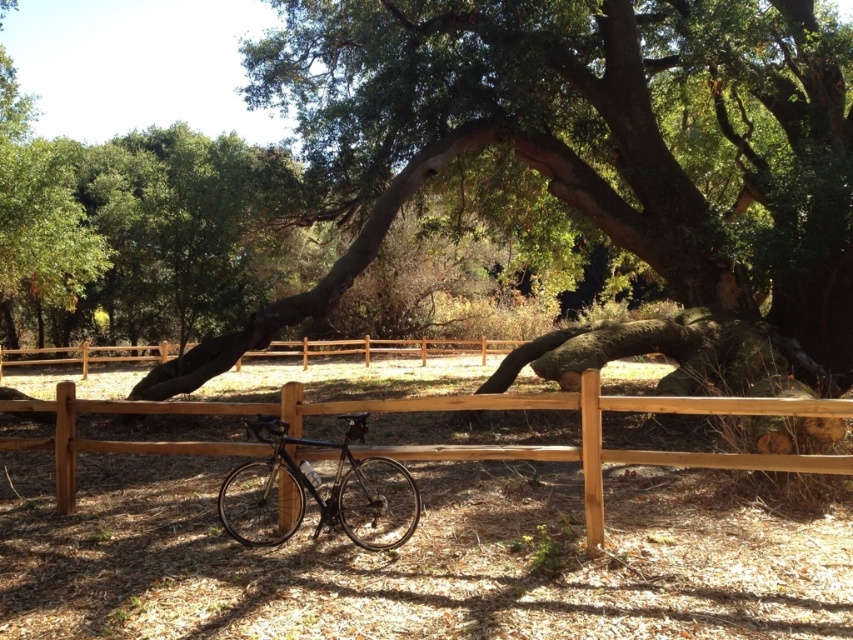
Question: Is green leafy tree at center positioned at the back of shiny black bicycle at center?

Choices:
 (A) yes
 (B) no

Answer: (A)

Question: Where is brown wooden fence at center located in relation to shiny black bicycle at center in the image?

Choices:
 (A) right
 (B) left

Answer: (B)

Question: Based on their relative distances, which object is farther from the green leafy tree at center?

Choices:
 (A) brown wooden fence at center
 (B) shiny black bicycle at center

Answer: (A)

Question: Does green leafy tree at center have a larger size compared to brown wooden fence at center?

Choices:
 (A) no
 (B) yes

Answer: (B)

Question: Which point appears closest to the camera in this image?

Choices:
 (A) (550, 106)
 (B) (350, 456)
 (C) (685, 406)

Answer: (C)

Question: Estimate the real-world distances between objects in this image. Which object is farther from the shiny black bicycle at center?

Choices:
 (A) brown wooden fence at center
 (B) green leafy tree at center

Answer: (B)